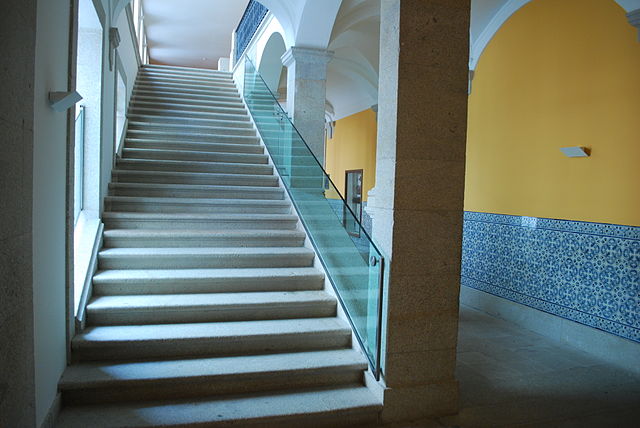
This screenshot has width=640, height=428. In order to click on yellow wall in this screenshot , I will do `click(524, 141)`.